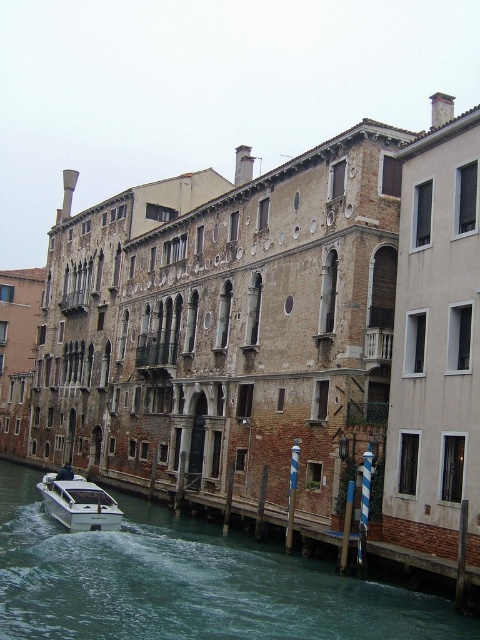
Question: Can you confirm if clear water at lower left is smaller than white glossy boat at lower left?

Choices:
 (A) yes
 (B) no

Answer: (A)

Question: Which point appears farthest from the camera in this image?

Choices:
 (A) (437, 614)
 (B) (96, 484)

Answer: (B)

Question: Which point is closer to the camera?

Choices:
 (A) clear water at lower left
 (B) white glossy boat at lower left

Answer: (A)

Question: Can you confirm if clear water at lower left is thinner than white glossy boat at lower left?

Choices:
 (A) yes
 (B) no

Answer: (B)

Question: Does clear water at lower left have a lesser width compared to white glossy boat at lower left?

Choices:
 (A) no
 (B) yes

Answer: (A)

Question: Which point is farther to the camera?

Choices:
 (A) (420, 628)
 (B) (99, 488)

Answer: (B)